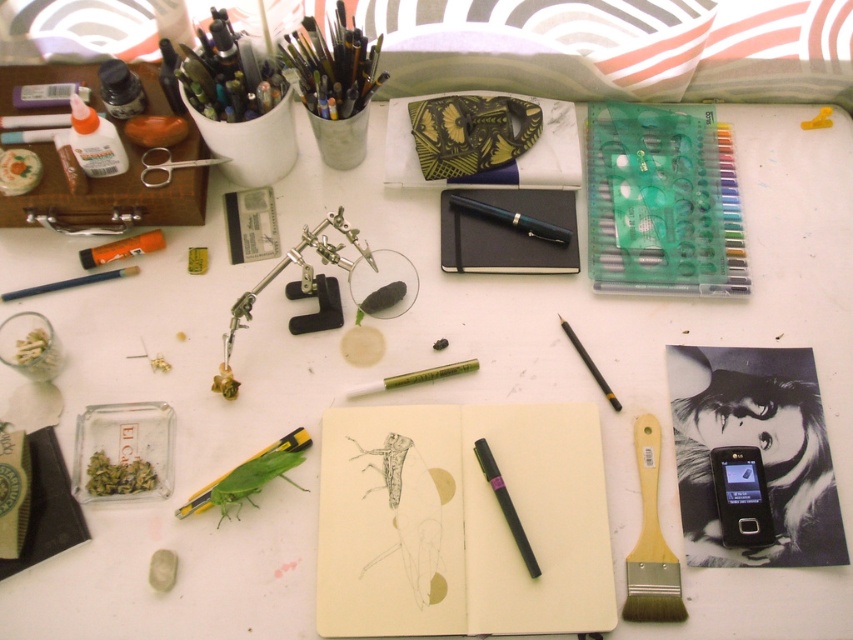
You are an artist trying to locate your black matte pen at center. Based on the coordinates provided, can you determine if it is closer to the left or right edge of the workspace?

The black matte pen at center is located at point 0.789 on the x and y axis, which is closer to the right edge of the workspace.

You are an artist who needs to place a new item between the metallic silver insect at center and the green matte pen at center. Based on their current positions, where should you position the new item?

The metallic silver insect at center is to the left of the green matte pen at center, so you should place the new item between them, to the right of the metallic silver insect at center and to the left of the green matte pen at center.

You are an artist who just finished a project and wants to organize your tools. You need to place the translucent plastic markers at upper right and the wooden paintbrush at lower right into a storage box. The box has a compartment that can only hold items within 12 inches of each other. Can both items fit in the same compartment?

The translucent plastic markers at upper right is 13.51 inches from the wooden paintbrush at lower right, which exceeds the 12 inches limit. Therefore, both items cannot fit in the same compartment.